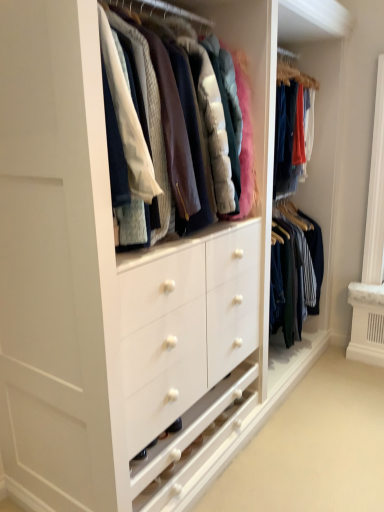
This screenshot has height=512, width=384. What do you see at coordinates (175, 141) in the screenshot? I see `matte white jackets at center` at bounding box center [175, 141].

Locate an element on the screen. Image resolution: width=384 pixels, height=512 pixels. matte white jackets at center is located at coordinates (175, 141).

I want to click on matte white jackets at center, so click(x=175, y=141).